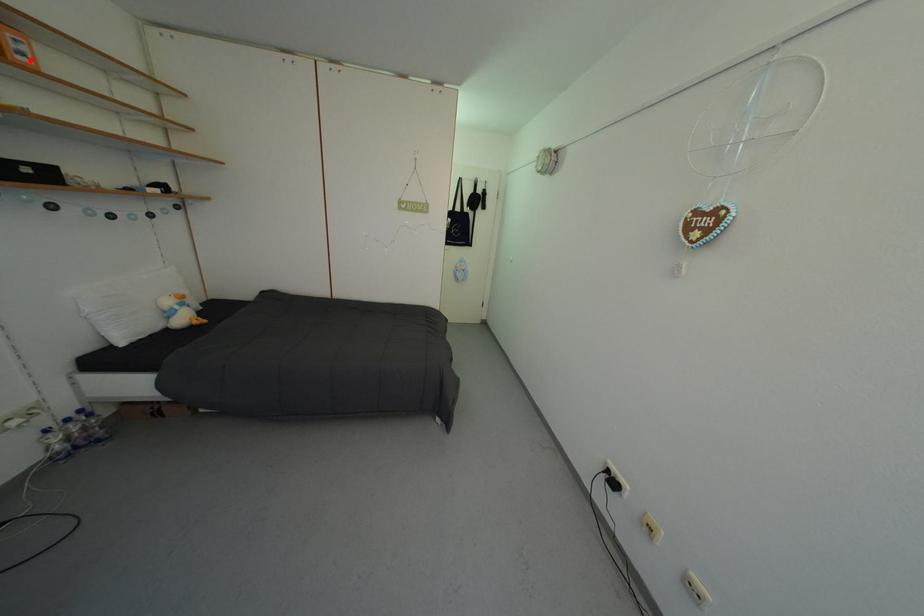
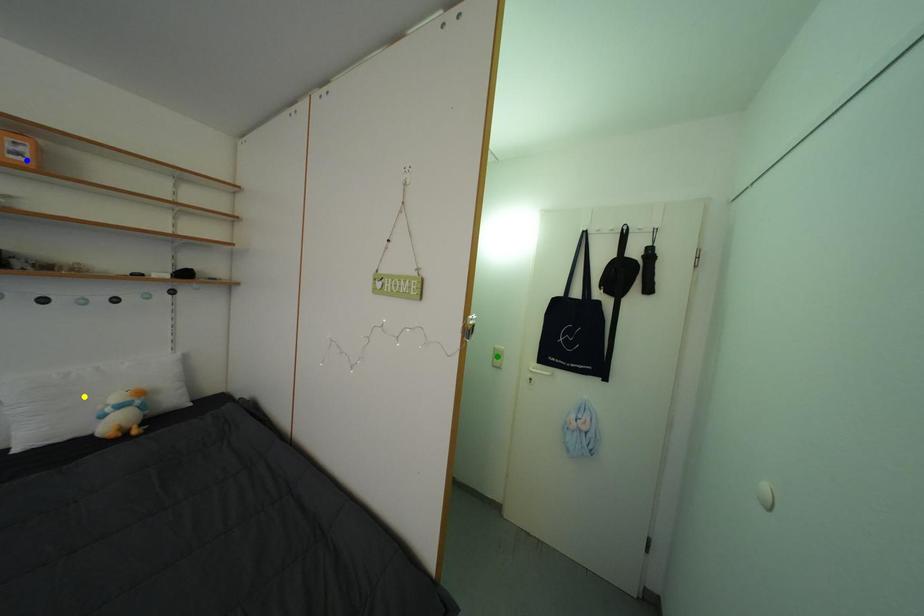
Question: I am providing you with two images of the same scene from different viewpoints. A red point is marked on the first image. You are given multiple points on the second image. In image 2, which mark is for the same physical point as the one in image 1?

Choices:
 (A) yellow point
 (B) green point
 (C) blue point

Answer: (C)